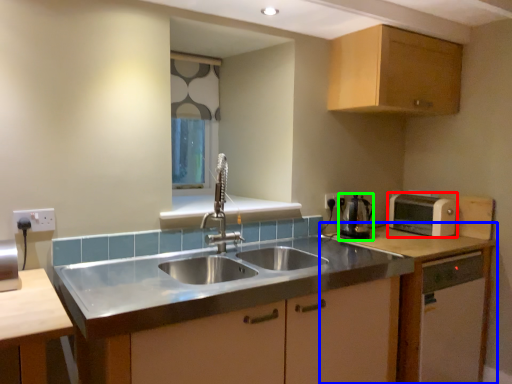
Question: Which object is positioned closest to toaster (highlighted by a red box)? Select from cabinetry (highlighted by a blue box) and appliance (highlighted by a green box).

Choices:
 (A) cabinetry
 (B) appliance

Answer: (A)